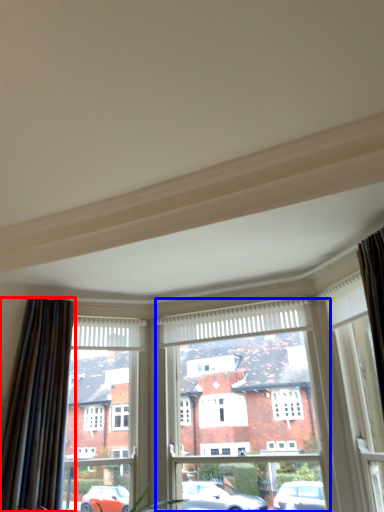
Question: Which point is further to the camera, curtain (highlighted by a red box) or window frame (highlighted by a blue box)?

Choices:
 (A) curtain
 (B) window frame

Answer: (B)